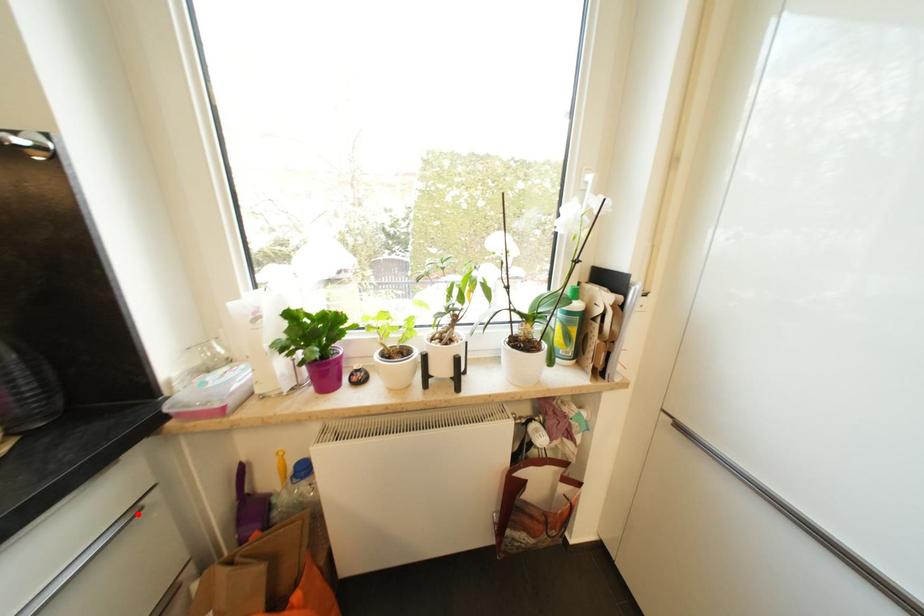
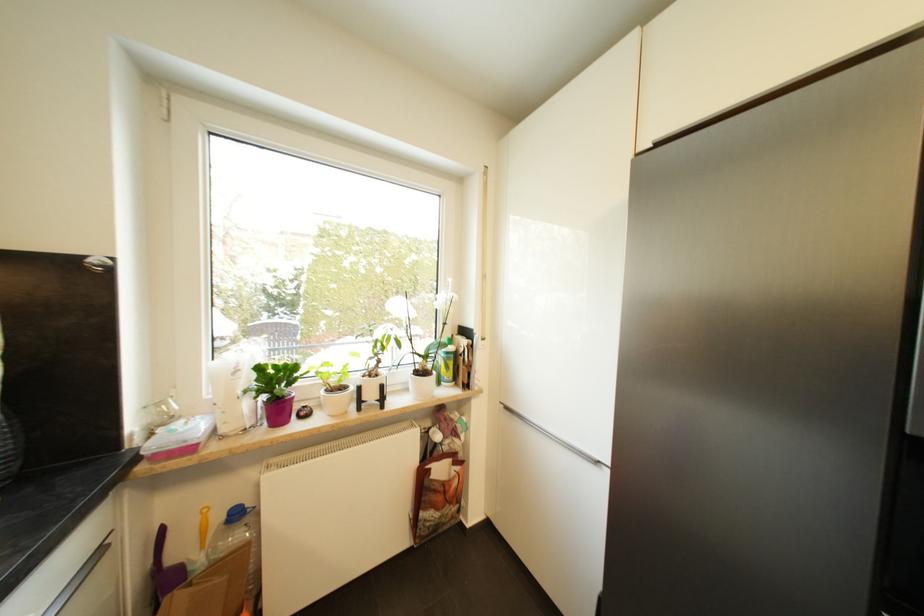
Find the pixel in the second image that matches the highlighted location in the first image.

(105, 553)